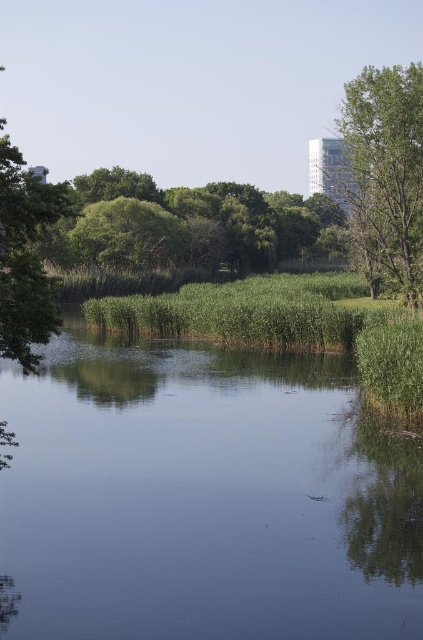
Question: Which object appears closest to the camera in this image?

Choices:
 (A) green leafy tree at upper right
 (B) green grassy river at center
 (C) green leafy tree at left

Answer: (B)

Question: Is green leafy tree at upper right thinner than green leafy tree at left?

Choices:
 (A) yes
 (B) no

Answer: (B)

Question: Among these objects, which one is farthest from the camera?

Choices:
 (A) green leafy tree at left
 (B) green leafy tree at upper right
 (C) green grassy river at center

Answer: (B)

Question: Is green grassy river at center to the left of green leafy tree at upper right from the viewer's perspective?

Choices:
 (A) yes
 (B) no

Answer: (A)

Question: Is the position of green grassy river at center more distant than that of green leafy tree at upper right?

Choices:
 (A) yes
 (B) no

Answer: (B)

Question: Which of the following is the closest to the observer?

Choices:
 (A) green grassy river at center
 (B) green leafy tree at left

Answer: (A)